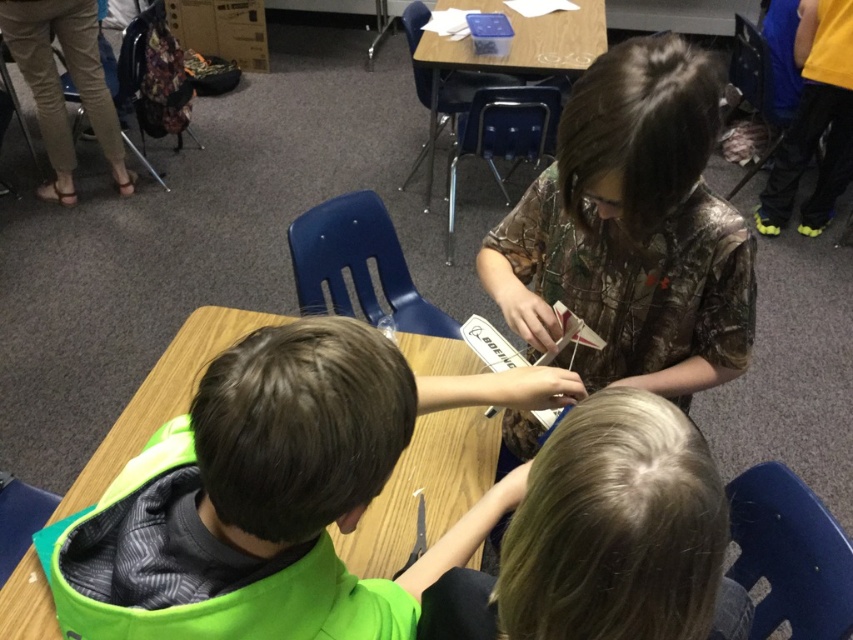
You are a teacher observing the classroom activity. You need to check if the child with the green fabric shirt at center is sitting directly in front of the child with blonde hair at center. Can you confirm this based on their positions?

The green fabric shirt at center is positioned over blonde hair at center, which means the child with the green fabric shirt at center is indeed sitting directly in front of the child with blonde hair at center.

Where is the green fabric shirt at center located in the image?

The green fabric shirt at center is located at point (258, 496) in the image.